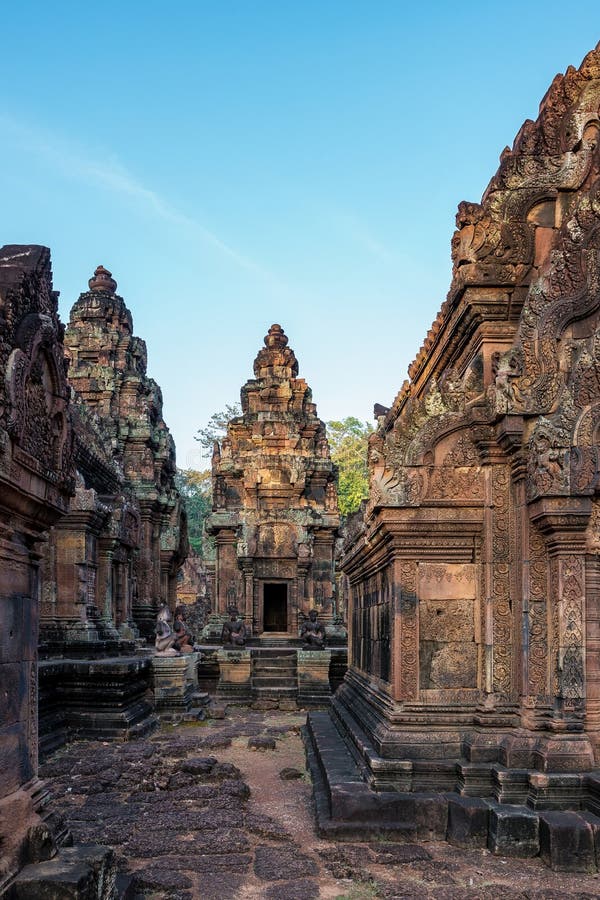
You are a GUI agent. You are given a task and a screenshot of the screen. Output one action in this format:
    pyautogui.click(x=<x>, y=<y>)
    Task: Click on the stairs
    The width and height of the screenshot is (600, 900).
    Given the screenshot: What is the action you would take?
    pyautogui.click(x=268, y=679), pyautogui.click(x=275, y=668), pyautogui.click(x=277, y=659), pyautogui.click(x=274, y=650)